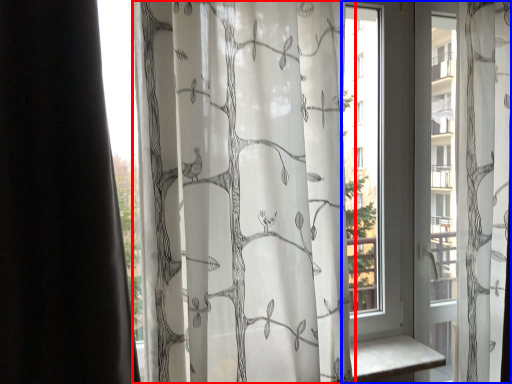
Question: Which of the following is the closest to the observer, curtain (highlighted by a red box) or window (highlighted by a blue box)?

Choices:
 (A) curtain
 (B) window

Answer: (A)